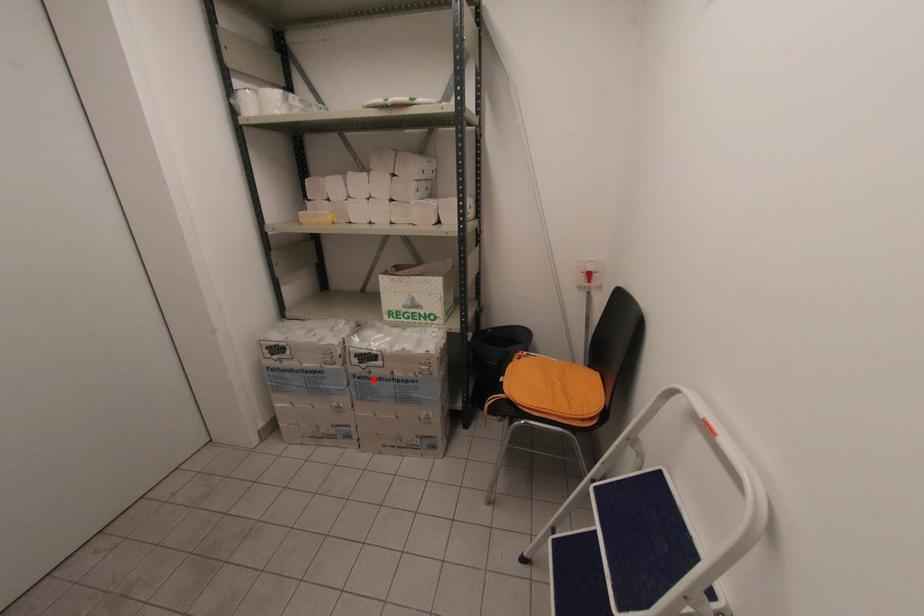
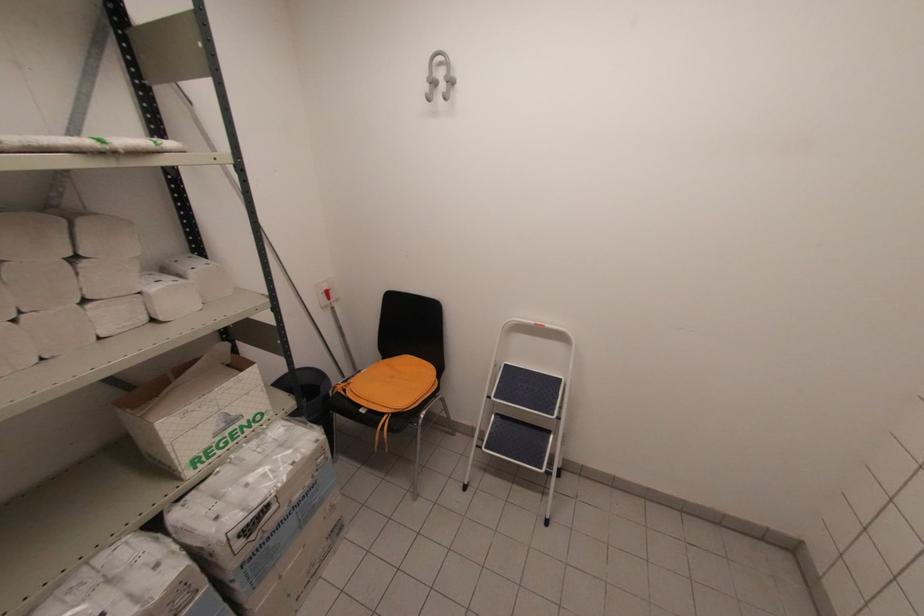
Question: A red point is marked in image1. In image2, is the corresponding 3D point closer to the camera or farther? Reply with the corresponding letter.

Choices:
 (A) The corresponding 3D point is closer.
 (B) The corresponding 3D point is farther.

Answer: (A)